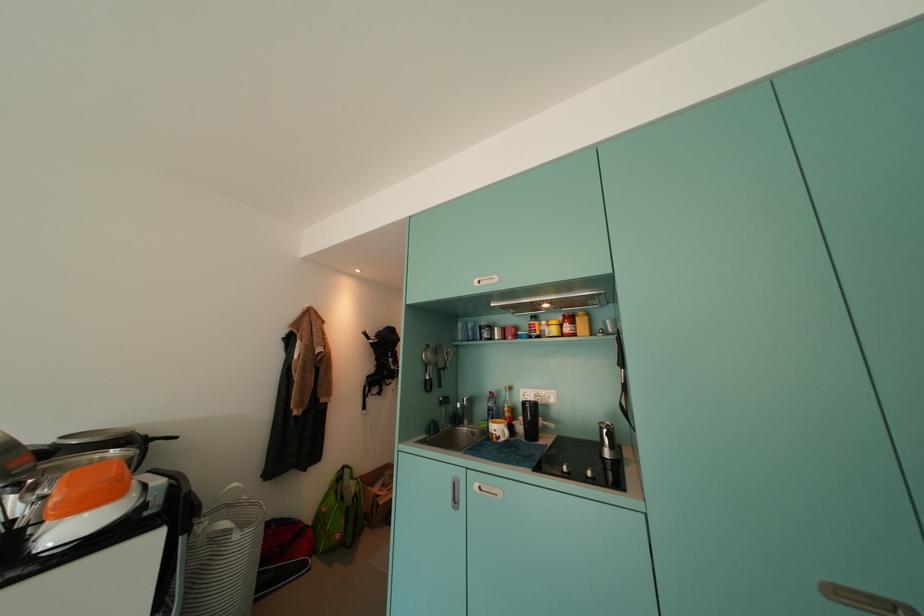
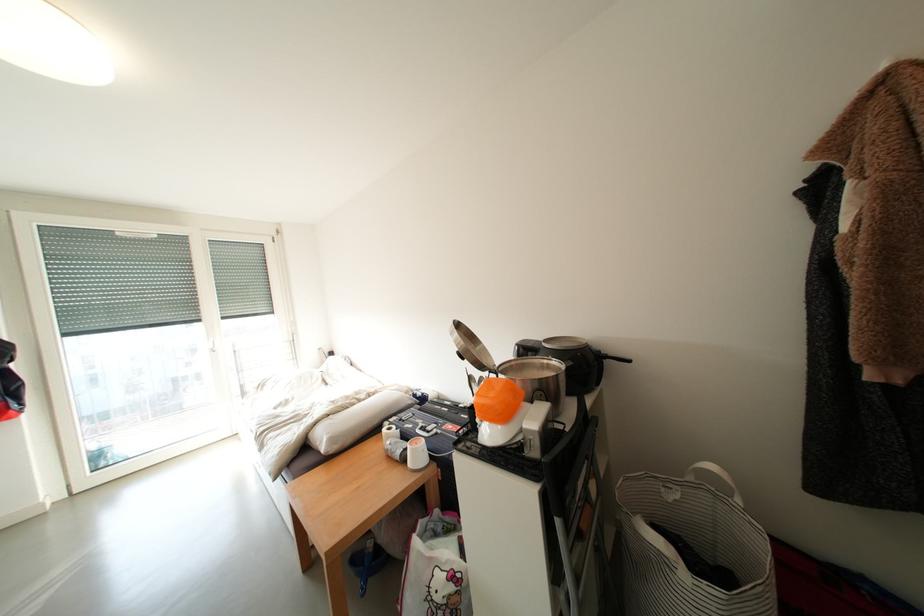
In the second image, find the point that corresponds to the point at 71,440 in the first image.

(553, 344)